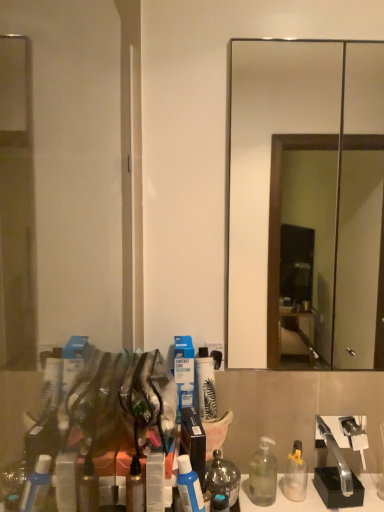
Question: Can we say smooth glass mirror at center lies outside satin silver mouthwash at lower center?

Choices:
 (A) yes
 (B) no

Answer: (A)

Question: Does smooth glass mirror at center have a lesser width compared to satin silver mouthwash at lower center?

Choices:
 (A) no
 (B) yes

Answer: (B)

Question: Is satin silver mouthwash at lower center inside smooth glass mirror at center?

Choices:
 (A) no
 (B) yes

Answer: (A)

Question: Is smooth glass mirror at center bigger than satin silver mouthwash at lower center?

Choices:
 (A) no
 (B) yes

Answer: (B)

Question: Is smooth glass mirror at center positioned with its back to satin silver mouthwash at lower center?

Choices:
 (A) yes
 (B) no

Answer: (B)

Question: Based on their sizes in the image, would you say smooth glass mirror at center is bigger or smaller than transparent glass door at left?

Choices:
 (A) small
 (B) big

Answer: (A)

Question: Is smooth glass mirror at center wider or thinner than transparent glass door at left?

Choices:
 (A) wide
 (B) thin

Answer: (B)

Question: From a real-world perspective, is smooth glass mirror at center physically located above or below transparent glass door at left?

Choices:
 (A) below
 (B) above

Answer: (B)

Question: Does point (349, 110) appear closer or farther from the camera than point (130, 249)?

Choices:
 (A) farther
 (B) closer

Answer: (A)

Question: Does point (87, 98) appear closer or farther from the camera than point (336, 165)?

Choices:
 (A) farther
 (B) closer

Answer: (B)

Question: Is transparent glass door at left inside or outside of smooth glass mirror at center?

Choices:
 (A) outside
 (B) inside

Answer: (A)

Question: Relative to smooth glass mirror at center, is transparent glass door at left in front or behind?

Choices:
 (A) behind
 (B) front

Answer: (B)

Question: From the image's perspective, is transparent glass door at left positioned above or below smooth glass mirror at center?

Choices:
 (A) below
 (B) above

Answer: (A)

Question: Considering the positions of blue cardboard box at center, the second toiletry positioned from the right, and transparent glass door at left in the image, is blue cardboard box at center, the second toiletry positioned from the right, wider or thinner than transparent glass door at left?

Choices:
 (A) thin
 (B) wide

Answer: (A)

Question: Considering the positions of blue cardboard box at center, the first toiletry in the left-to-right sequence, and transparent glass door at left in the image, is blue cardboard box at center, the first toiletry in the left-to-right sequence, bigger or smaller than transparent glass door at left?

Choices:
 (A) small
 (B) big

Answer: (A)